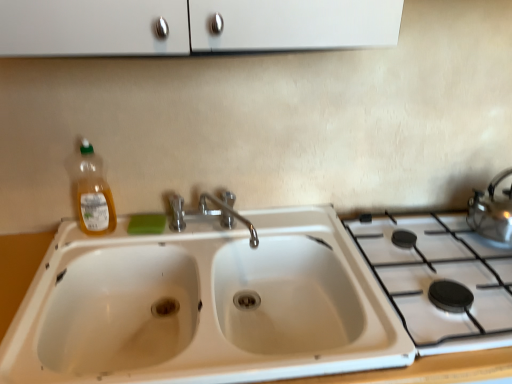
Locate an element on the screen. This screenshot has width=512, height=384. vacant region to the right of translucent plastic bottle at left is located at coordinates (134, 235).